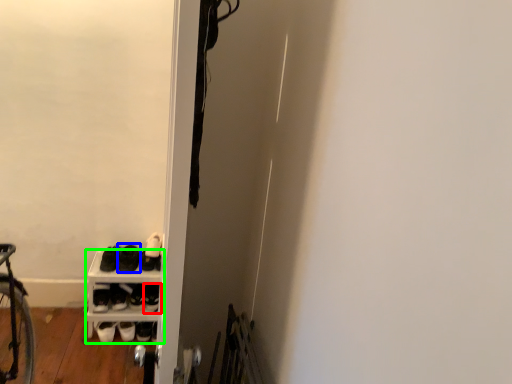
Question: Based on their relative distances, which object is farther from footwear (highlighted by a red box)? Choose from footwear (highlighted by a blue box) and shelf (highlighted by a green box).

Choices:
 (A) footwear
 (B) shelf

Answer: (A)